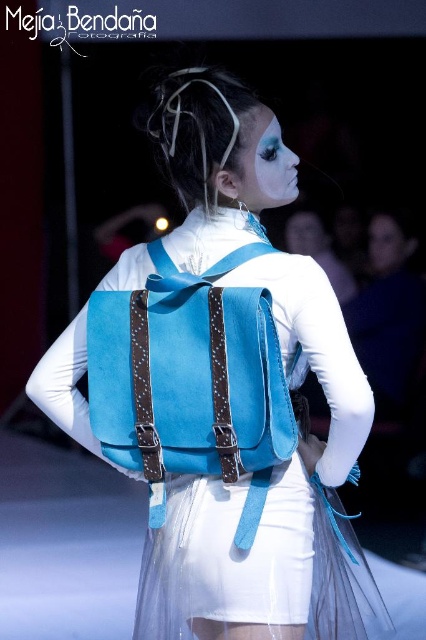
Does suede/leather strap at back have a smaller size compared to matte white face at center?

No, suede/leather strap at back is not smaller than matte white face at center.

Who is taller, suede/leather strap at back or matte white face at center?

suede/leather strap at back

I want to click on suede/leather strap at back, so click(209, 381).